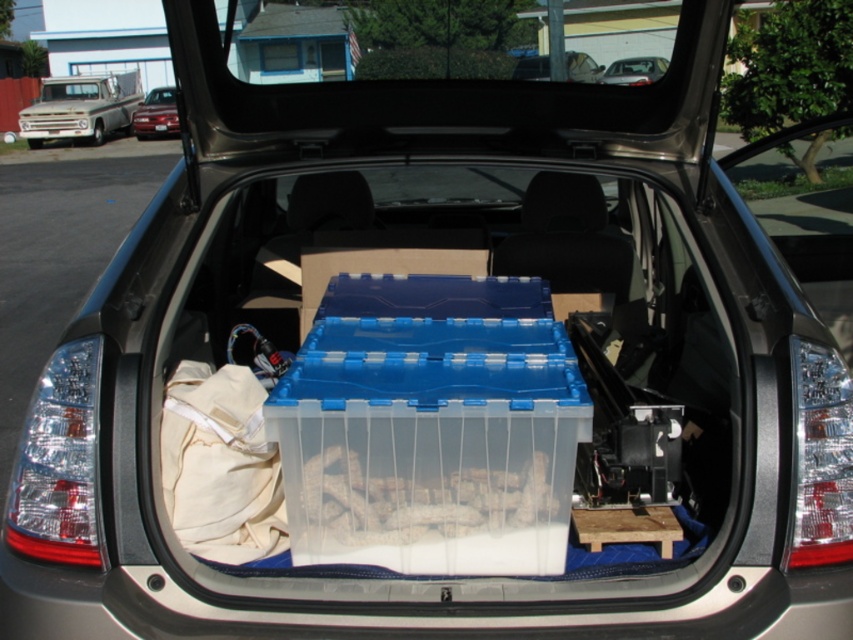
Question: Which of the following is the farthest from the observer?

Choices:
 (A) matte black car at upper center
 (B) shiny red sedan at upper left
 (C) matte blue plastic container at center

Answer: (B)

Question: Which point is farther to the camera?

Choices:
 (A) (643, 74)
 (B) (544, 56)
 (C) (154, 132)
 (D) (97, 84)

Answer: (D)

Question: Based on their relative distances, which object is farther from the shiny red sedan at upper left?

Choices:
 (A) matte blue plastic container at center
 (B) matte black car at upper center

Answer: (B)

Question: Does shiny red sedan at upper left have a lesser width compared to matte blue plastic container at center?

Choices:
 (A) no
 (B) yes

Answer: (A)

Question: Is shiny red sedan at upper left positioned before matte blue plastic container at center?

Choices:
 (A) yes
 (B) no

Answer: (B)

Question: Does matte silver truck at upper left have a lesser width compared to shiny red sedan at upper left?

Choices:
 (A) no
 (B) yes

Answer: (A)